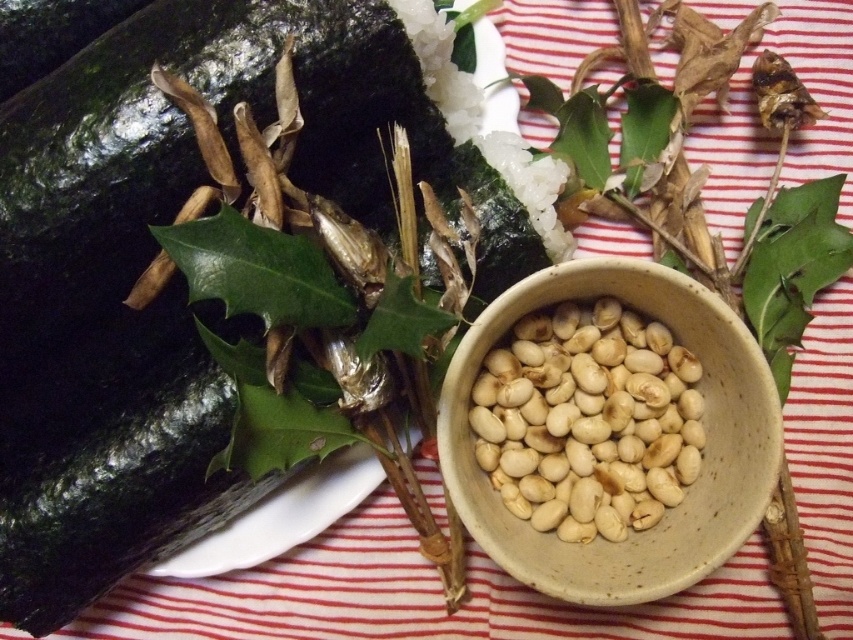
From the picture: Who is more forward, (x=767, y=449) or (x=474, y=420)?

Point (x=767, y=449)

Does white ceramic bowl at center appear on the left side of white matte beans at center?

Incorrect, white ceramic bowl at center is not on the left side of white matte beans at center.

What do you see at coordinates (688, 488) in the screenshot? I see `white ceramic bowl at center` at bounding box center [688, 488].

What are the coordinates of `white ceramic bowl at center` in the screenshot? It's located at (688, 488).

Between green matte cucumber at upper left and white matte beans at center, which one has less height?

Standing shorter between the two is white matte beans at center.

Is point (271, 481) behind point (474, 406)?

Yes, point (271, 481) is farther from viewer.

Is point (9, 611) positioned behind point (595, 490)?

That is False.

Identify the location of green matte cucumber at upper left. The width and height of the screenshot is (853, 640). (175, 275).

Based on the photo, is green matte cucumber at upper left bigger than white ceramic bowl at center?

Yes, green matte cucumber at upper left is bigger than white ceramic bowl at center.

Image resolution: width=853 pixels, height=640 pixels. I want to click on green matte cucumber at upper left, so click(x=175, y=275).